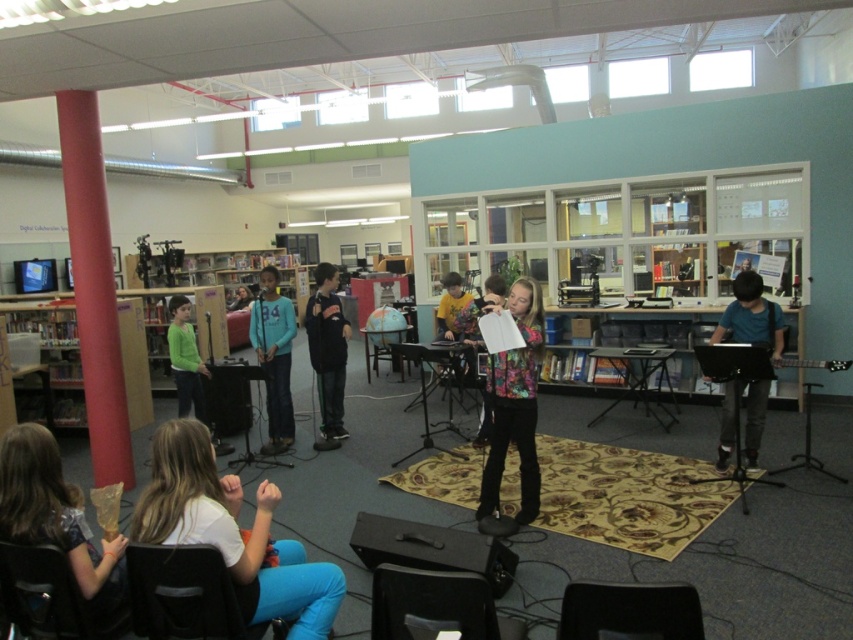
You are organizing a small concert in the school library and need to place a black plastic chair at lower left next to a black electric guitar at right. Will the chair fit comfortably next to the guitar without overcrowding the space?

The black plastic chair at lower left has a smaller width than the black electric guitar at right, so placing them side by side should be possible without overcrowding the space.

You are standing at the entrance of the library and want to find the white cotton shirt at lower left. According to the coordinates provided, where should you look relative to the entrance?

The white cotton shirt at lower left is located at point 0.834 on the x axis and 0.274 on the y axis, so you should look towards the lower left direction from the entrance to find it.

You are a visitor in the library and need to sit down. You see a black plastic chair at lower left and a black electric guitar at right. Which object is taller and can you sit on it?

The black plastic chair at lower left is taller than the black electric guitar at right. You can sit on the black plastic chair at lower left since it is taller and likely designed for sitting.